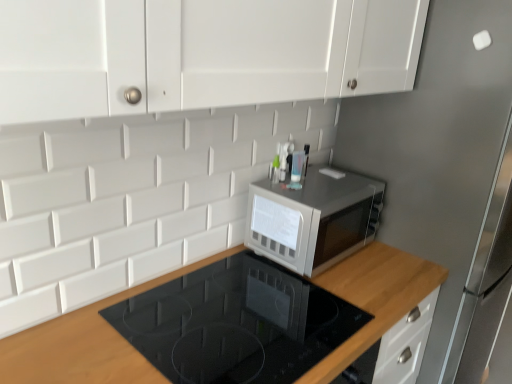
Find the location of `free space above wooden at upper right (from a real-world perspective)`. free space above wooden at upper right (from a real-world perspective) is located at coordinates (233, 316).